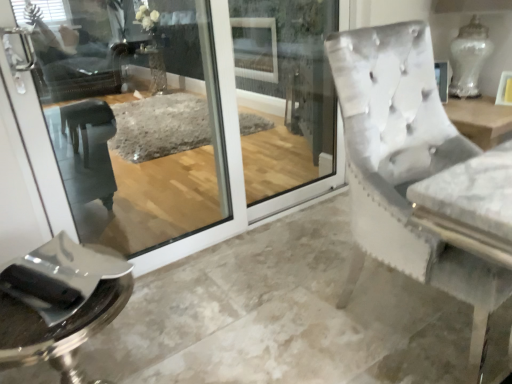
I want to click on free area in between polished chrome tray at lower left and clear glass screen door at center, so click(226, 286).